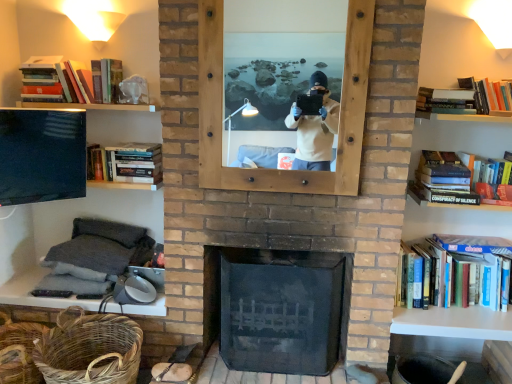
This screenshot has height=384, width=512. What do you see at coordinates (461, 180) in the screenshot?
I see `hardcover book at right, which appears as the third book when viewed from the right` at bounding box center [461, 180].

In order to face woven brown basket at lower left, the first basket from the right, should I rotate leftwards or rightwards?

You should look left and rotate roughly 21.145 degrees.

What do you see at coordinates (341, 111) in the screenshot?
I see `wooden mirror at center` at bounding box center [341, 111].

Measure the distance between point (x=414, y=334) and camera.

Point (x=414, y=334) is 2.36 meters from camera.

This screenshot has height=384, width=512. In order to click on hardcover books at left, which appears as the fifth book when ordered from the bottom in this screenshot , I will do `click(66, 77)`.

How many degrees apart are the facing directions of hardcover book at right, arranged as the fourth book when viewed from the top, and hardcover book at right, acting as the fourth book starting from the left?

They differ by 2.14 degrees in their facing directions.

Is hardcover book at right, which is the third book from left to right, smaller than hardcover book at right, which appears as the fifth book when viewed from the top?

Indeed, hardcover book at right, which is the third book from left to right, has a smaller size compared to hardcover book at right, which appears as the fifth book when viewed from the top.

Considering the positions of objects hardcover book at right, which is the third book from left to right, and hardcover book at right, which appears as the fifth book when viewed from the top, in the image provided, who is in front, hardcover book at right, which is the third book from left to right, or hardcover book at right, which appears as the fifth book when viewed from the top,?

hardcover book at right, which is the third book from left to right.

In order to click on mantle to the right of hardcover book at right, which is counted as the second book, starting from the bottom in this screenshot , I will do `click(454, 322)`.

In terms of width, does white matte shelf at right, which is counted as the 2th mantle, starting from the left, look wider or thinner when compared to hardcover book at right, which appears as the third book when viewed from the right?

In the image, white matte shelf at right, which is counted as the 2th mantle, starting from the left, appears to be wider than hardcover book at right, which appears as the third book when viewed from the right.

Is there a large distance between white matte shelf at right, which is counted as the 2th mantle, starting from the left, and hardcover book at right, which is counted as the second book, starting from the bottom?

No, white matte shelf at right, which is counted as the 2th mantle, starting from the left, is not far away from hardcover book at right, which is counted as the second book, starting from the bottom.

Is white matte shelf at right, which is counted as the 2th mantle, starting from the left, bigger than hardcover book at right, which is counted as the second book, starting from the bottom?

Correct, white matte shelf at right, which is counted as the 2th mantle, starting from the left, is larger in size than hardcover book at right, which is counted as the second book, starting from the bottom.

Considering the positions of objects woven natural basket at lower left, the second basket positioned from the right, and hardcover book at right, which is counted as the second book, starting from the bottom, in the image provided, who is behind, woven natural basket at lower left, the second basket positioned from the right, or hardcover book at right, which is counted as the second book, starting from the bottom,?

Positioned behind is hardcover book at right, which is counted as the second book, starting from the bottom.

Is woven natural basket at lower left, the second basket positioned from the right, turned away from hardcover book at right, which is counted as the second book, starting from the bottom?

No, woven natural basket at lower left, the second basket positioned from the right, is not facing away from hardcover book at right, which is counted as the second book, starting from the bottom.

Considering the relative positions of woven natural basket at lower left, the first basket positioned from the left, and hardcover book at right, arranged as the fourth book when viewed from the top, in the image provided, is woven natural basket at lower left, the first basket positioned from the left, to the left of hardcover book at right, arranged as the fourth book when viewed from the top, from the viewer's perspective?

Yes, woven natural basket at lower left, the first basket positioned from the left, is to the left of hardcover book at right, arranged as the fourth book when viewed from the top.

Does white matte shelf at right, which is counted as the 2th mantle, starting from the left, appear on the right side of hardcover book at left, which is counted as the 2th book, starting from the left?

Yes.

From a real-world perspective, starting from the hardcover book at left, which ranks as the fourth book in right-to-left order, which mantle is the 1st one below it? Please provide its 2D coordinates.

[(454, 322)]

Between point (455, 319) and point (95, 153), which one is positioned behind?

Positioned behind is point (95, 153).

From the picture: Could you tell me if white matte shelf at right, which is counted as the 2th mantle, starting from the left, is facing hardcover book at left, which is counted as the 2th book, starting from the left?

No, white matte shelf at right, which is counted as the 2th mantle, starting from the left, does not turn towards hardcover book at left, which is counted as the 2th book, starting from the left.

Who is shorter, black glass fireplace at center or hardcover book at right, which appears as the 1th book when ordered from the bottom?

Standing shorter between the two is hardcover book at right, which appears as the 1th book when ordered from the bottom.

Are black glass fireplace at center and hardcover book at right, acting as the fourth book starting from the left, located far from each other?

That's not correct — black glass fireplace at center is a little close to hardcover book at right, acting as the fourth book starting from the left.

From a real-world perspective, which object stands above the other?

In real-world perspective, hardcover book at right, acting as the fourth book starting from the left, is above.

Is black glass fireplace at center turned away from hardcover book at right, acting as the second book starting from the right?

No.

From the picture: Considering the relative positions of matte black tv at left and woven natural basket at lower left, the second basket positioned from the right, in the image provided, is matte black tv at left to the right of woven natural basket at lower left, the second basket positioned from the right, from the viewer's perspective?

Yes, matte black tv at left is to the right of woven natural basket at lower left, the second basket positioned from the right.

Considering the sizes of objects matte black tv at left and woven natural basket at lower left, the first basket positioned from the left, in the image provided, who is wider, matte black tv at left or woven natural basket at lower left, the first basket positioned from the left,?

Wider between the two is woven natural basket at lower left, the first basket positioned from the left.

Is matte black tv at left placed right next to woven natural basket at lower left, the first basket positioned from the left?

No, matte black tv at left is not next to woven natural basket at lower left, the first basket positioned from the left.

Is matte black tv at left outside of woven natural basket at lower left, the second basket positioned from the right?

Yes, matte black tv at left is outside of woven natural basket at lower left, the second basket positioned from the right.

Is hardcover book at right, acting as the second book starting from the right, with hardcover book at upper right, placed as the fifth book when sorted from left to right?

hardcover book at right, acting as the second book starting from the right, is not next to hardcover book at upper right, placed as the fifth book when sorted from left to right, and they're not touching.

Could you measure the distance between hardcover book at right, acting as the second book starting from the right, and hardcover book at upper right, the fourth book ordered from the bottom?

hardcover book at right, acting as the second book starting from the right, is 32.60 inches away from hardcover book at upper right, the fourth book ordered from the bottom.

At what (x,y) coordinates should I click in order to perform the action: click on the 3rd book located beneath the hardcover book at upper right, arranged as the 2th book when viewed from the top (from a real-world perspective). Please return your answer as a coordinate pair (x, y). The height and width of the screenshot is (384, 512). Looking at the image, I should click on (459, 272).

Is hardcover book at right, acting as the fourth book starting from the left, not within hardcover book at upper right, the fourth book ordered from the bottom?

Yes, hardcover book at right, acting as the fourth book starting from the left, is outside of hardcover book at upper right, the fourth book ordered from the bottom.

Starting from the hardcover book at right, acting as the fourth book starting from the left, which book is the 1st one to the left? Please provide its 2D coordinates.

[(461, 180)]

The image size is (512, 384). What are the coordinates of `the 1st mantle behind when counting from the hardcover book at right, arranged as the fourth book when viewed from the top` in the screenshot? It's located at (454, 322).

Based on their spatial positions, is woven natural basket at lower left, the second basket positioned from the right, or hardcover book at upper right, the fourth book ordered from the bottom, further from matte black tv at left?

Based on the image, hardcover book at upper right, the fourth book ordered from the bottom, appears to be further to matte black tv at left.

Considering their positions, is hardcover book at right, which appears as the third book when viewed from the right, positioned further to gray fabric pillow at lower left, marked as the first mantle in a left-to-right arrangement, than hardcover book at upper right, arranged as the 2th book when viewed from the top?

hardcover book at upper right, arranged as the 2th book when viewed from the top, lies further to gray fabric pillow at lower left, marked as the first mantle in a left-to-right arrangement, than the other object.

From the image, which object appears to be farther from wooden mirror at center, hardcover book at upper right, placed as the fifth book when sorted from left to right, or hardcover book at left, which ranks as the fourth book in right-to-left order?

hardcover book at upper right, placed as the fifth book when sorted from left to right, is further to wooden mirror at center.

Considering their positions, is woven natural basket at lower left, the second basket positioned from the right, positioned further to hardcover book at upper right, the fourth book ordered from the bottom, than hardcover book at right, arranged as the fourth book when viewed from the top?

woven natural basket at lower left, the second basket positioned from the right, lies further to hardcover book at upper right, the fourth book ordered from the bottom, than the other object.

Consider the image. From the image, which object appears to be nearer to dark gray fabric at lower left, hardcover books at left, which appears as the fifth book when ordered from the bottom, or hardcover book at left, the third book from the bottom?

hardcover book at left, the third book from the bottom.

Considering their positions, is woven brown basket at lower left, the 2th basket in the left-to-right sequence, positioned closer to matte black tv at left than black glass fireplace at center?

The object closer to matte black tv at left is woven brown basket at lower left, the 2th basket in the left-to-right sequence.

When comparing their distances from hardcover book at right, acting as the second book starting from the right, does black glass fireplace at center or woven natural basket at lower left, the second basket positioned from the right, seem closer?

black glass fireplace at center is positioned closer to the anchor hardcover book at right, acting as the second book starting from the right.

From the image, which object appears to be farther from white matte shelf at right, which ranks as the first mantle in right-to-left order, black glass fireplace at center or dark gray fabric at lower left?

dark gray fabric at lower left is further to white matte shelf at right, which ranks as the first mantle in right-to-left order.

At what (x,y) coordinates should I click in order to perform the action: click on mantle situated between hardcover book at left, which is counted as the third book, starting from the top, and hardcover book at right, which appears as the fifth book when viewed from the top, from left to right. Please return your answer as a coordinate pair (x, y). The image size is (512, 384). Looking at the image, I should click on (454, 322).

I want to click on sit situated between gray fabric pillow at lower left, marked as the first mantle in a left-to-right arrangement, and wooden mirror at center from left to right, so click(100, 249).

At what (x,y) coordinates should I click in order to perform the action: click on fireplace between gray fabric pillow at lower left, marked as the first mantle in a left-to-right arrangement, and hardcover book at right, acting as the fourth book starting from the left, in the horizontal direction. Please return your answer as a coordinate pair (x, y). Looking at the image, I should click on (281, 310).

Locate an element on the screen. The width and height of the screenshot is (512, 384). picture frame between dark gray fabric at lower left and hardcover book at upper right, the fourth book ordered from the bottom, from left to right is located at coordinates (341, 111).